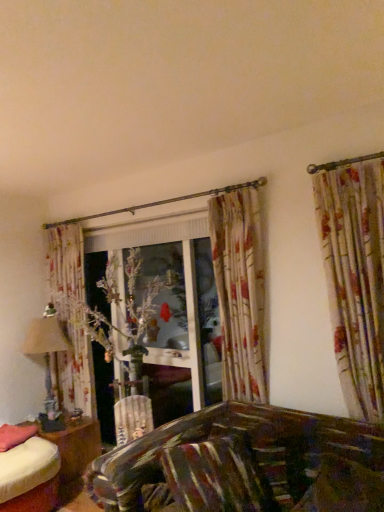
Question: In terms of height, does matte beige lampshade at left look taller or shorter compared to wooden table at lower left?

Choices:
 (A) short
 (B) tall

Answer: (B)

Question: In terms of width, does matte beige lampshade at left look wider or thinner when compared to wooden table at lower left?

Choices:
 (A) wide
 (B) thin

Answer: (B)

Question: Which of these objects is positioned closest to the wooden table at lower left?

Choices:
 (A) matte beige lampshade at left
 (B) pink fabric pillow at lower left, positioned as the second pillow in right-to-left order
 (C) striped fabric pillow at lower center, the first pillow when ordered from right to left

Answer: (B)

Question: Which is farther from the wooden table at lower left?

Choices:
 (A) striped fabric pillow at lower center, the 2th pillow from the left
 (B) matte beige lampshade at left
 (C) pink fabric pillow at lower left, which is the first pillow in back-to-front order

Answer: (A)